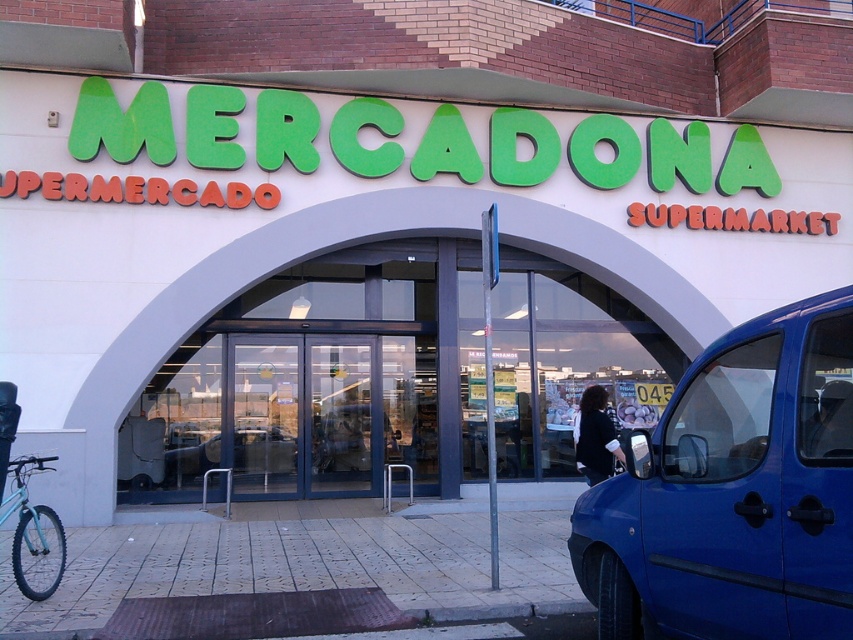
Is point (257, 132) in front of point (726, 588)?

No.

You are a GUI agent. You are given a task and a screenshot of the screen. Output one action in this format:
    pyautogui.click(x=<x>, y=<y>)
    Task: Click on the white/glass storefront at center
    Image resolution: width=853 pixels, height=640 pixels.
    Given the screenshot: What is the action you would take?
    pyautogui.click(x=352, y=259)

The image size is (853, 640). Describe the element at coordinates (734, 492) in the screenshot. I see `blue metallic van at right` at that location.

Between blue metallic van at right and light blue matte bicycle at lower left, which one has less height?

light blue matte bicycle at lower left

What do you see at coordinates (734, 492) in the screenshot?
I see `blue metallic van at right` at bounding box center [734, 492].

At what (x,y) coordinates should I click in order to perform the action: click on blue metallic van at right. Please return your answer as a coordinate pair (x, y). Looking at the image, I should click on (734, 492).

Does white/glass storefront at center have a smaller size compared to light blue matte bicycle at lower left?

Incorrect, white/glass storefront at center is not smaller in size than light blue matte bicycle at lower left.

Looking at this image, is white/glass storefront at center below light blue matte bicycle at lower left?

No.

Between point (402, 198) and point (15, 548), which one is positioned behind?

Positioned behind is point (402, 198).

The image size is (853, 640). Identify the location of white/glass storefront at center. (352, 259).